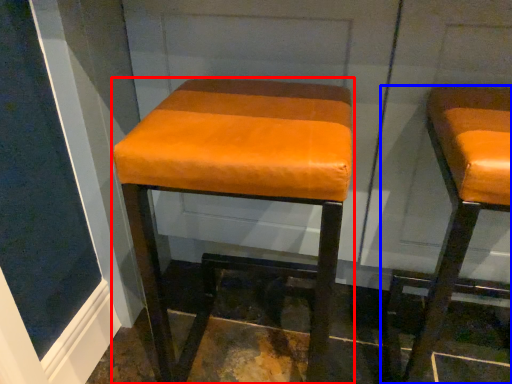
Question: Which object appears closest to the camera in this image, stool (highlighted by a red box) or stool (highlighted by a blue box)?

Choices:
 (A) stool
 (B) stool

Answer: (B)